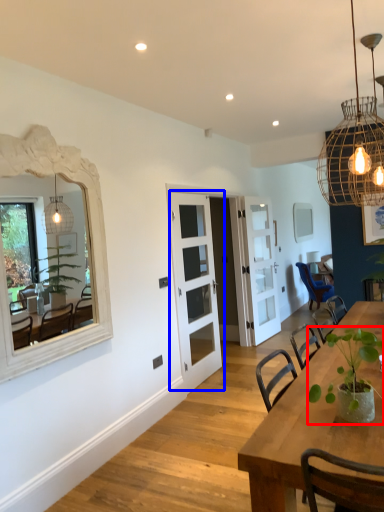
Question: Which object is closer to the camera taking this photo, houseplant (highlighted by a red box) or door (highlighted by a blue box)?

Choices:
 (A) houseplant
 (B) door

Answer: (A)